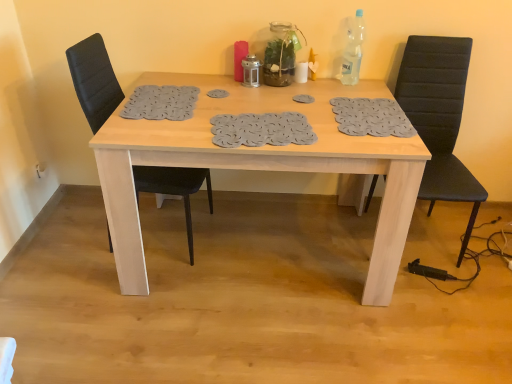
Locate an element on the screen. Image resolution: width=512 pixels, height=384 pixels. free point above light wood table at center (from a real-world perspective) is located at coordinates (266, 108).